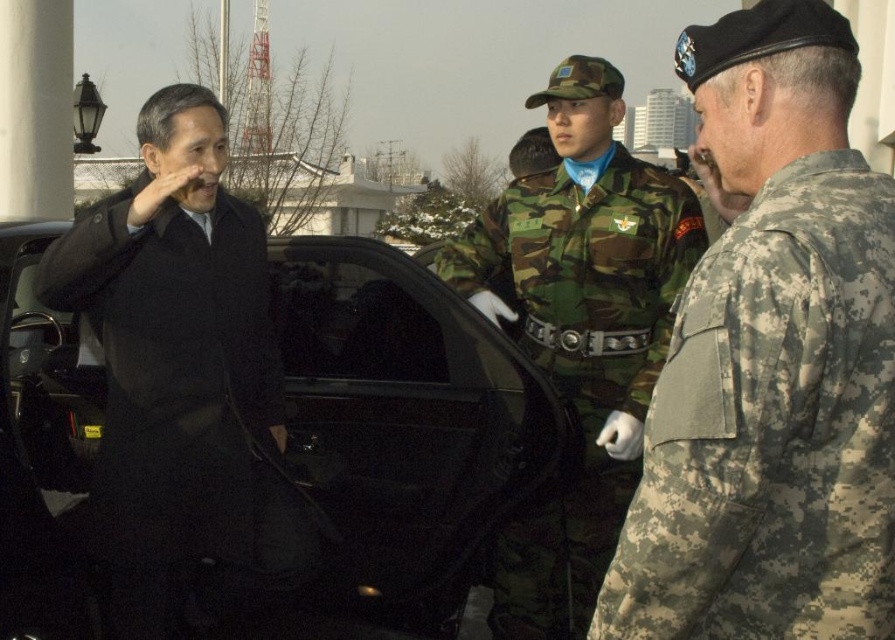
Which is behind, point (867, 532) or point (98, 300)?

Point (98, 300)

Is the position of camouflage fabric uniform at right more distant than that of black wool coat at left?

No, camouflage fabric uniform at right is closer to the viewer.

In order to click on camouflage fabric uniform at right in this screenshot , I will do `click(772, 428)`.

Is black matte car at center in front of camo fabric uniform at center?

No, black matte car at center is further to the viewer.

What are the coordinates of `black matte car at center` in the screenshot? It's located at (406, 428).

I want to click on black matte car at center, so click(x=406, y=428).

Does point (111, 275) come behind point (493, 588)?

No, it is in front of (493, 588).

Which is more to the left, black wool coat at left or camo fabric uniform at center?

Positioned to the left is black wool coat at left.

Who is more distant from viewer, (x=91, y=512) or (x=668, y=209)?

The point (x=668, y=209) is more distant.

Identify the location of black wool coat at left. This screenshot has height=640, width=895. (179, 403).